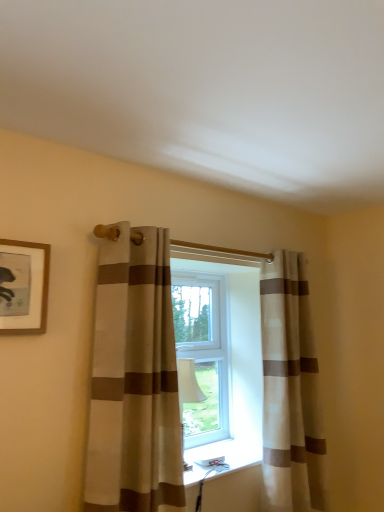
Measure the distance between point (156, 338) and camera.

Point (156, 338) and camera are 5.53 feet apart from each other.

At what (x,y) coordinates should I click in order to perform the action: click on beige striped curtain at center, arranged as the first curtain when viewed from the back. Please return your answer as a coordinate pair (x, y). This screenshot has height=512, width=384. Looking at the image, I should click on (290, 391).

In terms of height, does wooden-framed picture at upper left look taller or shorter compared to beige striped curtain at center, which is the 1th curtain in right-to-left order?

Clearly, wooden-framed picture at upper left is shorter compared to beige striped curtain at center, which is the 1th curtain in right-to-left order.

Locate an element on the screen. the 2nd curtain below the wooden-framed picture at upper left (from the image's perspective) is located at coordinates (290, 391).

Which object is further away from the camera, wooden-framed picture at upper left or beige striped curtain at center, the 2th curtain when ordered from left to right?

beige striped curtain at center, the 2th curtain when ordered from left to right, is further away from the camera.

In the scene shown: Which of these two, wooden-framed picture at upper left or beige striped curtain at center, the 2th curtain when ordered from left to right, is wider?

Wider between the two is beige striped curtain at center, the 2th curtain when ordered from left to right.

Between beige striped curtain at center, the 2th curtain positioned from the front, and beige striped curtain at center, the 2th curtain when ordered from back to front, which one has larger size?

Bigger between the two is beige striped curtain at center, the 2th curtain when ordered from back to front.

Considering the positions of points (276, 446) and (170, 289), is point (276, 446) farther from camera compared to point (170, 289)?

That is False.

Image resolution: width=384 pixels, height=512 pixels. What are the coordinates of `curtain lying on the left of beige striped curtain at center, the 2th curtain positioned from the front` in the screenshot? It's located at (134, 378).

Could you measure the distance between beige striped curtain at center, which is the 1th curtain in right-to-left order, and beige striped curtain at center, the 2th curtain when ordered from back to front?

beige striped curtain at center, which is the 1th curtain in right-to-left order, and beige striped curtain at center, the 2th curtain when ordered from back to front, are 31.74 inches apart from each other.

Measure the distance between beige striped curtain at center, the 2th curtain when ordered from back to front, and wooden-framed picture at upper left.

beige striped curtain at center, the 2th curtain when ordered from back to front, is 15.86 inches from wooden-framed picture at upper left.

Considering the points (170, 431) and (12, 276), which point is in front, point (170, 431) or point (12, 276)?

The point (12, 276) is in front.

Which is in front, beige striped curtain at center, the 2th curtain when ordered from back to front, or wooden-framed picture at upper left?

wooden-framed picture at upper left is closer to the camera.

In the image, there is a beige striped curtain at center, which is the 1th curtain in right-to-left order. Identify the location of curtain above it (from the image's perspective). (134, 378).

From a real-world perspective, does beige striped curtain at center, which is the 2th curtain from right to left, stand above beige striped curtain at center, which is the 1th curtain in right-to-left order?

Correct, in the physical world, beige striped curtain at center, which is the 2th curtain from right to left, is higher than beige striped curtain at center, which is the 1th curtain in right-to-left order.

Between point (136, 304) and point (294, 257), which one is positioned behind?

The point (294, 257) is behind.

Is point (13, 319) positioned behind point (166, 429)?

That is False.

From the image's perspective, would you say wooden-framed picture at upper left is shown under beige striped curtain at center, which is the 2th curtain from right to left?

No, from the image's perspective, wooden-framed picture at upper left is not below beige striped curtain at center, which is the 2th curtain from right to left.

From a real-world perspective, which is physically above, wooden-framed picture at upper left or beige striped curtain at center, which is the 2th curtain from right to left?

wooden-framed picture at upper left is physically above.

You are a GUI agent. You are given a task and a screenshot of the screen. Output one action in this format:
    pyautogui.click(x=<x>, y=<y>)
    Task: Click on the picture frame above the beige striped curtain at center, the 2th curtain when ordered from back to front (from a real-world perspective)
    Image resolution: width=384 pixels, height=512 pixels.
    Given the screenshot: What is the action you would take?
    pyautogui.click(x=23, y=287)

Relative to wooden-framed picture at upper left, is beige striped curtain at center, the 2th curtain positioned from the front, in front or behind?

In the image, beige striped curtain at center, the 2th curtain positioned from the front, appears behind wooden-framed picture at upper left.

From the picture: From the image's perspective, is beige striped curtain at center, the 2th curtain positioned from the front, below wooden-framed picture at upper left?

Yes, from the image's perspective, beige striped curtain at center, the 2th curtain positioned from the front, is below wooden-framed picture at upper left.

Is beige striped curtain at center, arranged as the first curtain when viewed from the back, facing away from wooden-framed picture at upper left?

No, beige striped curtain at center, arranged as the first curtain when viewed from the back,'s orientation is not away from wooden-framed picture at upper left.

Consider the image. Considering the relative sizes of beige striped curtain at center, arranged as the first curtain when viewed from the back, and wooden-framed picture at upper left in the image provided, is beige striped curtain at center, arranged as the first curtain when viewed from the back, wider than wooden-framed picture at upper left?

Yes.

Find the location of a particular element. The image size is (384, 512). the 2nd curtain behind when counting from the wooden-framed picture at upper left is located at coordinates (290, 391).

Find the location of `curtain above the beige striped curtain at center, which is the 1th curtain in right-to-left order (from a real-world perspective)`. curtain above the beige striped curtain at center, which is the 1th curtain in right-to-left order (from a real-world perspective) is located at coordinates (134, 378).

Which object lies nearer to the anchor point beige striped curtain at center, acting as the first curtain starting from the left, wooden-framed picture at upper left or beige striped curtain at center, arranged as the first curtain when viewed from the back?

Based on the image, wooden-framed picture at upper left appears to be nearer to beige striped curtain at center, acting as the first curtain starting from the left.

Looking at the image, which one is located closer to wooden-framed picture at upper left, beige striped curtain at center, which is the 2th curtain from right to left, or beige striped curtain at center, which is the 1th curtain in right-to-left order?

Among the two, beige striped curtain at center, which is the 2th curtain from right to left, is located nearer to wooden-framed picture at upper left.

Which object lies nearer to the anchor point beige striped curtain at center, arranged as the first curtain when viewed from the back, wooden-framed picture at upper left or beige striped curtain at center, placed as the 1th curtain when sorted from front to back?

The object closer to beige striped curtain at center, arranged as the first curtain when viewed from the back, is beige striped curtain at center, placed as the 1th curtain when sorted from front to back.

Looking at the image, which one is located further to wooden-framed picture at upper left, beige striped curtain at center, arranged as the first curtain when viewed from the back, or beige striped curtain at center, placed as the 1th curtain when sorted from front to back?

Based on the image, beige striped curtain at center, arranged as the first curtain when viewed from the back, appears to be further to wooden-framed picture at upper left.

Estimate the real-world distances between objects in this image. Which object is further from beige striped curtain at center, the 2th curtain when ordered from left to right, beige striped curtain at center, the 2th curtain when ordered from back to front, or wooden-framed picture at upper left?

Based on the image, wooden-framed picture at upper left appears to be further to beige striped curtain at center, the 2th curtain when ordered from left to right.

When comparing their distances from beige striped curtain at center, which is the 2th curtain from right to left, does beige striped curtain at center, the 2th curtain positioned from the front, or wooden-framed picture at upper left seem further?

beige striped curtain at center, the 2th curtain positioned from the front, is further to beige striped curtain at center, which is the 2th curtain from right to left.

Locate an element on the screen. The image size is (384, 512). curtain situated between wooden-framed picture at upper left and beige striped curtain at center, the 2th curtain positioned from the front, from left to right is located at coordinates (134, 378).